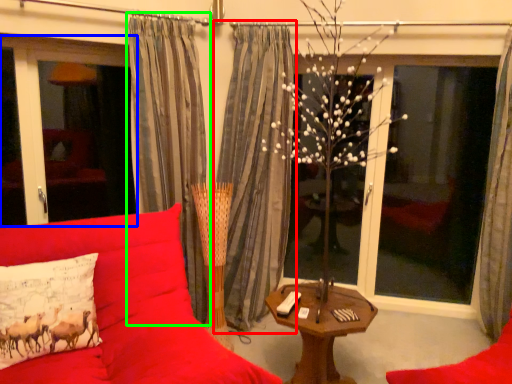
Question: Which object is the closest to the curtain (highlighted by a red box)? Choose among these: window screen (highlighted by a blue box) or curtain (highlighted by a green box).

Choices:
 (A) window screen
 (B) curtain

Answer: (B)